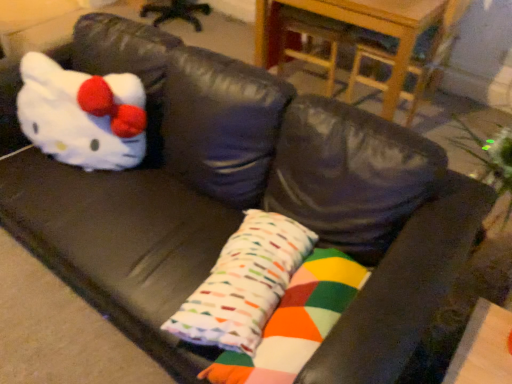
Question: Can you confirm if white plush toy at left is bigger than multicolored fabric pillow at center?

Choices:
 (A) no
 (B) yes

Answer: (B)

Question: Is white plush toy at left turned away from multicolored fabric pillow at center?

Choices:
 (A) yes
 (B) no

Answer: (B)

Question: Can you confirm if white plush toy at left is thinner than multicolored fabric pillow at center?

Choices:
 (A) yes
 (B) no

Answer: (B)

Question: Is white plush toy at left to the right of multicolored fabric pillow at center from the viewer's perspective?

Choices:
 (A) no
 (B) yes

Answer: (A)

Question: Is there a large distance between white plush toy at left and multicolored fabric pillow at center?

Choices:
 (A) no
 (B) yes

Answer: (A)

Question: Is multicolored fabric pillow at center wider or thinner than wooden table at upper center?

Choices:
 (A) thin
 (B) wide

Answer: (A)

Question: Considering the positions of multicolored fabric pillow at center and wooden table at upper center in the image, is multicolored fabric pillow at center taller or shorter than wooden table at upper center?

Choices:
 (A) tall
 (B) short

Answer: (B)

Question: Considering the relative positions of multicolored fabric pillow at center and wooden table at upper center in the image provided, is multicolored fabric pillow at center to the left or to the right of wooden table at upper center?

Choices:
 (A) right
 (B) left

Answer: (B)

Question: Considering the positions of point (253, 301) and point (394, 110), is point (253, 301) closer or farther from the camera than point (394, 110)?

Choices:
 (A) closer
 (B) farther

Answer: (A)

Question: From the image's perspective, is white plush toy at left above or below wooden table at upper center?

Choices:
 (A) below
 (B) above

Answer: (A)

Question: In terms of width, does white plush toy at left look wider or thinner when compared to wooden table at upper center?

Choices:
 (A) thin
 (B) wide

Answer: (A)

Question: From a real-world perspective, is white plush toy at left above or below wooden table at upper center?

Choices:
 (A) above
 (B) below

Answer: (A)

Question: Considering their positions, is white plush toy at left located in front of or behind wooden table at upper center?

Choices:
 (A) front
 (B) behind

Answer: (A)

Question: From the image's perspective, relative to multicolored fabric pillow at center, is white plush toy at left above or below?

Choices:
 (A) below
 (B) above

Answer: (B)

Question: Considering the positions of point (20, 125) and point (337, 274), is point (20, 125) closer or farther from the camera than point (337, 274)?

Choices:
 (A) closer
 (B) farther

Answer: (B)